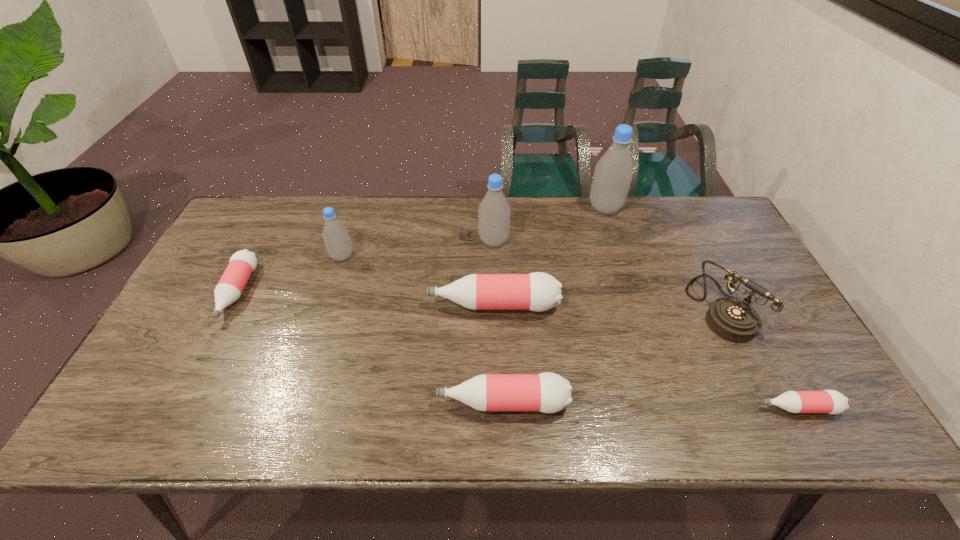
Locate an element on the screen. The width and height of the screenshot is (960, 540). telephone that is at the right edge is located at coordinates (733, 319).

This screenshot has width=960, height=540. Identify the location of bottle situated at the right edge. (827, 401).

I want to click on object that is at the near right corner, so click(x=827, y=401).

Where is `free space at the far edge of the desktop`? free space at the far edge of the desktop is located at coordinates (551, 200).

The height and width of the screenshot is (540, 960). Identify the location of blank area at the near edge. (648, 429).

Find the location of a particular element. The width and height of the screenshot is (960, 540). vacant region at the left edge is located at coordinates (211, 262).

The height and width of the screenshot is (540, 960). Find the location of `free space at the right edge of the desktop`. free space at the right edge of the desktop is located at coordinates (725, 280).

Find the location of a particular element. free space at the far left corner of the desktop is located at coordinates (257, 217).

In the image, there is a desktop. Identify the location of free space at the far right corner. (710, 210).

This screenshot has width=960, height=540. Identify the location of free area in between the telephone and the farthest gray bottle. pos(662,257).